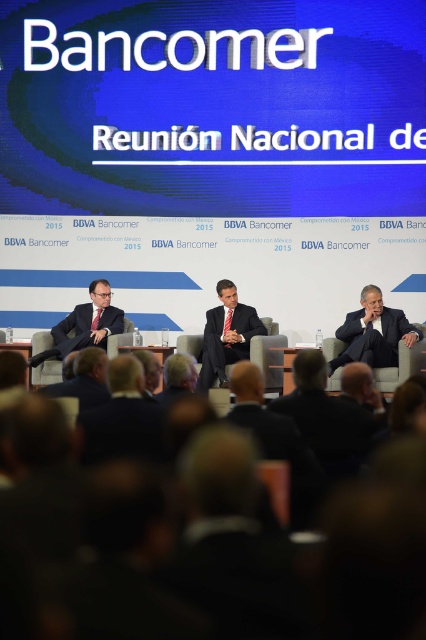
You are a photographer at the Bancomer National Meeting 2015. You need to capture a clear photo of both the dark blue suit at center and the matte black suit at center. Which suit will appear larger in your photo?

The dark blue suit at center will appear larger in the photo because it is closer to the viewer than the matte black suit at center.

You are attending the Bancomer National Meeting in 2015 and notice a matte black suit at right. Where exactly is it positioned in the image?

The matte black suit at right is located at point (374, 332) in the image coordinate system.

You are a photographer at the Bancomer National Meeting in 2015. You need to capture a group photo of the two people wearing matte black suits. The left one is standing closer to the center, while the right one is near the edge. Since the right person is taking up less space in the frame, how should you adjust your camera angle to ensure both matte black suit at right and matte black suit at left are equally visible?

Since the matte black suit at right occupies less space than the matte black suit at left, you should move the camera closer to the matte black suit at right to balance their sizes in the photo.